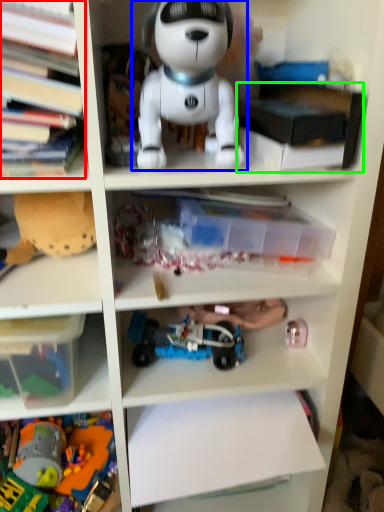
Question: Which object is the closest to the book (highlighted by a red box)? Choose among these: toy (highlighted by a blue box) or book (highlighted by a green box).

Choices:
 (A) toy
 (B) book

Answer: (A)